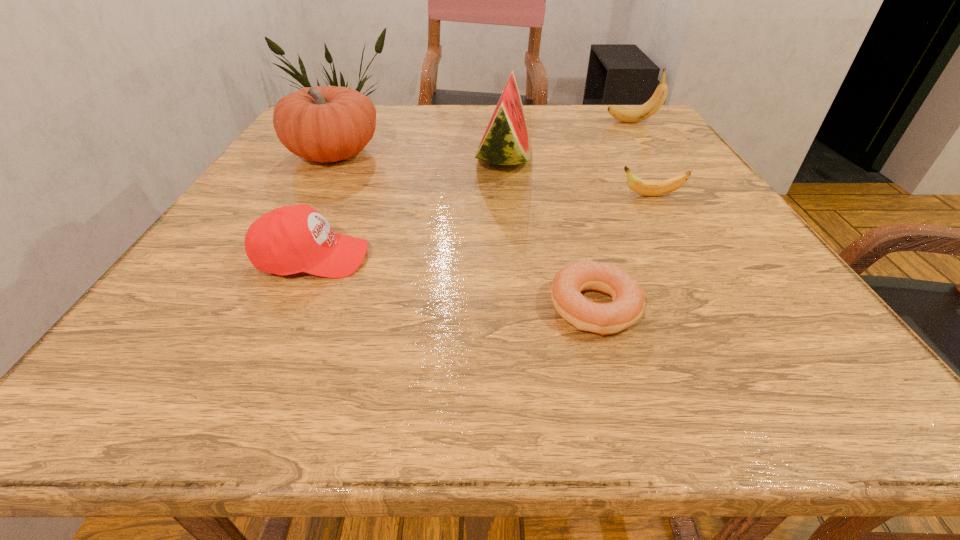
The height and width of the screenshot is (540, 960). In the image, there is a desktop. Find the location of `vacant space at the right edge`. vacant space at the right edge is located at coordinates (638, 148).

You are a GUI agent. You are given a task and a screenshot of the screen. Output one action in this format:
    pyautogui.click(x=<x>, y=<y>)
    Task: Click on the vacant area at the far right corner
    This screenshot has width=960, height=540.
    Given the screenshot: What is the action you would take?
    pyautogui.click(x=609, y=112)

At what (x,y) coordinates should I click in order to perform the action: click on blank region between the pumpkin and the watermelon. Please return your answer as a coordinate pair (x, y). Looking at the image, I should click on (419, 156).

Locate an element on the screen. Image resolution: width=960 pixels, height=540 pixels. vacant space that is in between the baseball cap and the farther banana is located at coordinates (472, 190).

Where is `free spot between the taller banana and the second shortest object`? Image resolution: width=960 pixels, height=540 pixels. free spot between the taller banana and the second shortest object is located at coordinates pyautogui.click(x=642, y=159).

The height and width of the screenshot is (540, 960). I want to click on vacant region between the fourth farthest object and the farther banana, so click(642, 159).

Locate an element on the screen. free space between the fifth tallest object and the watermelon is located at coordinates (577, 177).

Image resolution: width=960 pixels, height=540 pixels. What are the coordinates of `empty space between the shortest object and the third nearest object` in the screenshot? It's located at (623, 252).

This screenshot has height=540, width=960. Find the location of `vacant area that lies between the pumpkin and the third shortest object`. vacant area that lies between the pumpkin and the third shortest object is located at coordinates [x=324, y=206].

You are a GUI agent. You are given a task and a screenshot of the screen. Output one action in this format:
    pyautogui.click(x=<x>, y=<y>)
    Task: Click on the free space between the baseball cap and the bagel
    
    Given the screenshot: What is the action you would take?
    pyautogui.click(x=454, y=283)